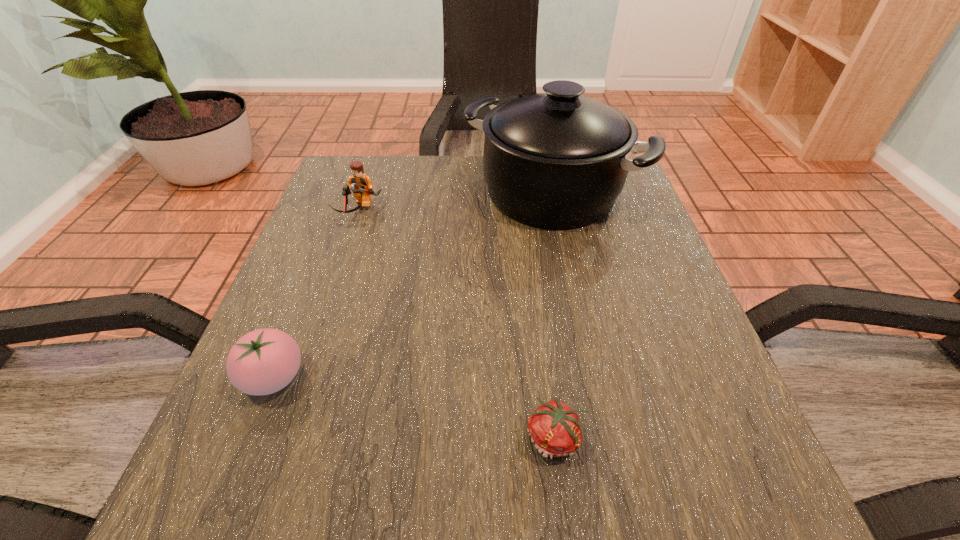
Where is `saucepan that is at the far edge`? The width and height of the screenshot is (960, 540). saucepan that is at the far edge is located at coordinates (557, 160).

This screenshot has height=540, width=960. In order to click on Lego that is at the far edge in this screenshot , I will do `click(361, 185)`.

At what (x,y) coordinates should I click in order to perform the action: click on object that is at the near edge. Please return your answer as a coordinate pair (x, y). The height and width of the screenshot is (540, 960). Looking at the image, I should click on (555, 428).

At what (x,y) coordinates should I click in order to perform the action: click on Lego positioned at the left edge. Please return your answer as a coordinate pair (x, y). The width and height of the screenshot is (960, 540). Looking at the image, I should click on (361, 185).

You are a GUI agent. You are given a task and a screenshot of the screen. Output one action in this format:
    pyautogui.click(x=<x>, y=<y>)
    Task: Click on the tomato at the left edge
    
    Given the screenshot: What is the action you would take?
    (264, 361)

The width and height of the screenshot is (960, 540). In order to click on object present at the right edge in this screenshot , I will do `click(557, 160)`.

In order to click on object present at the far left corner in this screenshot , I will do `click(361, 185)`.

Identify the location of object situated at the far right corner. The image size is (960, 540). (557, 160).

In order to click on free location at the far edge in this screenshot , I will do `click(420, 165)`.

The image size is (960, 540). In the image, there is a desktop. Identify the location of vacant space at the near edge. (345, 509).